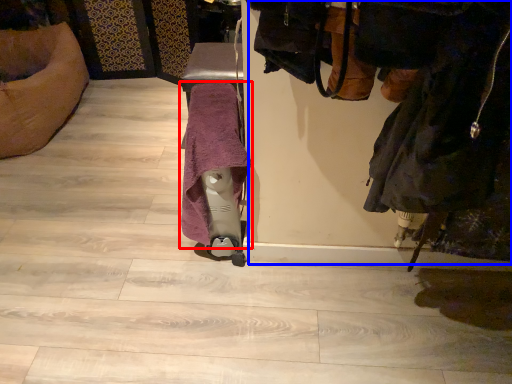
Question: Which object appears closest to the camera in this image, bath towel (highlighted by a red box) or laundry (highlighted by a blue box)?

Choices:
 (A) bath towel
 (B) laundry

Answer: (B)